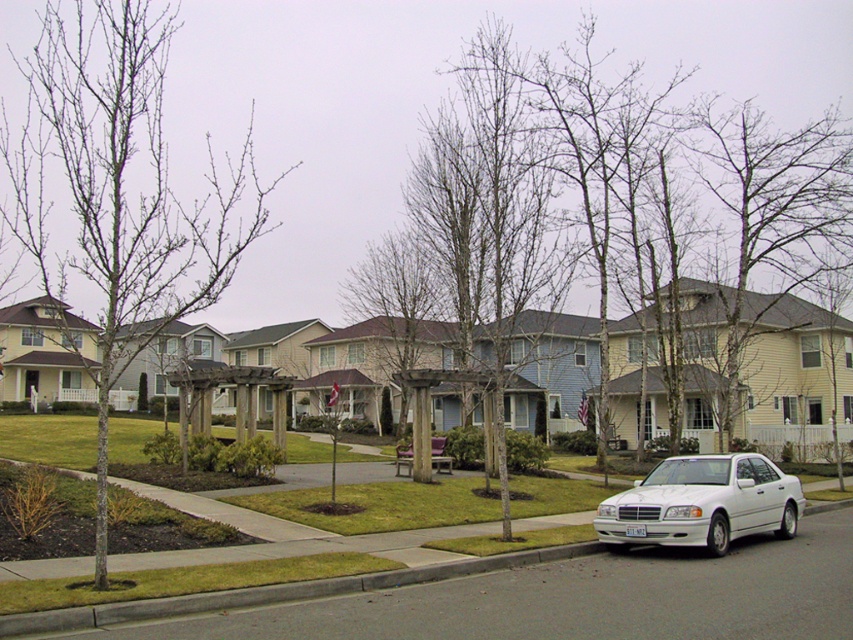
Does bare wood tree at left have a larger size compared to white glossy sedan at lower right?

Correct, bare wood tree at left is larger in size than white glossy sedan at lower right.

Can you confirm if bare wood tree at left is wider than white glossy sedan at lower right?

Indeed, bare wood tree at left has a greater width compared to white glossy sedan at lower right.

Where is `bare wood tree at left`? This screenshot has width=853, height=640. bare wood tree at left is located at coordinates coord(120,189).

From the picture: Which is above, bare wood tree at left or gray concrete curb at lower center?

bare wood tree at left is higher up.

Can you confirm if bare wood tree at left is positioned below gray concrete curb at lower center?

Incorrect, bare wood tree at left is not positioned below gray concrete curb at lower center.

Between point (242, 189) and point (257, 592), which one is positioned in front?

Point (257, 592)

You are a GUI agent. You are given a task and a screenshot of the screen. Output one action in this format:
    pyautogui.click(x=<x>, y=<y>)
    Task: Click on the bare wood tree at left
    
    Given the screenshot: What is the action you would take?
    pyautogui.click(x=120, y=189)

Consider the image. Does white glossy sedan at lower right come behind brown wood tree at center?

That is False.

Which is in front, point (648, 536) or point (412, 356)?

Point (648, 536) is more forward.

Which is behind, point (618, 529) or point (434, 308)?

The point (434, 308) is behind.

Find the location of `white glossy sedan at lower right`. white glossy sedan at lower right is located at coordinates (701, 502).